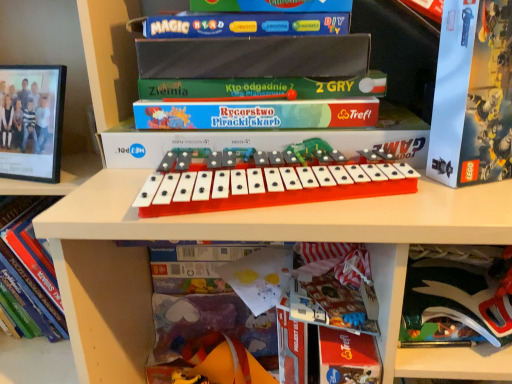
At what (x,y) coordinates should I click in order to perform the action: click on empty space that is in between orange plastic musical keyboard at center and matte green board game at center, marked as the third paperback book in a bottom-to-top arrangement. Please return your answer as a coordinate pair (x, y). The width and height of the screenshot is (512, 384). Looking at the image, I should click on (124, 187).